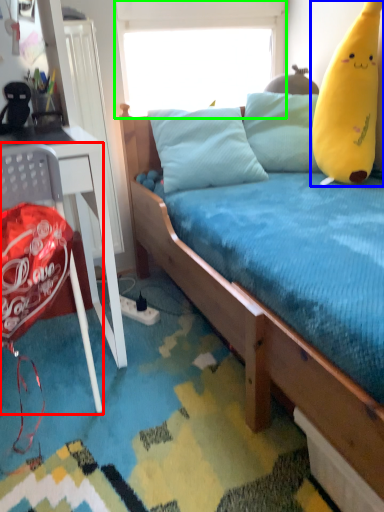
Question: Based on their relative distances, which object is farther from chair (highlighted by a red box)? Choose from toy (highlighted by a blue box) and window screen (highlighted by a green box).

Choices:
 (A) toy
 (B) window screen

Answer: (B)